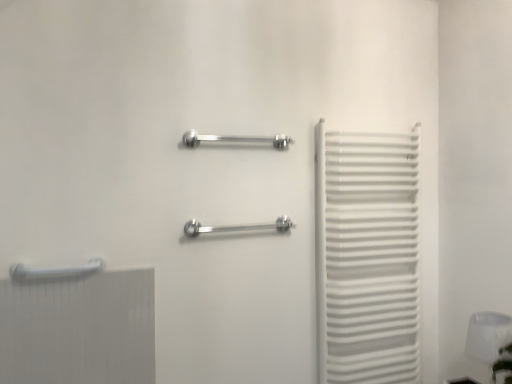
Question: Considering the relative sizes of white glossy towel rack at right and white glossy towel rack at lower left, which appears as the 1th towel rack when ordered from the bottom, in the image provided, is white glossy towel rack at right bigger than white glossy towel rack at lower left, which appears as the 1th towel rack when ordered from the bottom,?

Choices:
 (A) no
 (B) yes

Answer: (B)

Question: Would you say white glossy towel rack at right is a long distance from white glossy towel rack at lower left, marked as the 3th towel rack in a right-to-left arrangement?

Choices:
 (A) yes
 (B) no

Answer: (A)

Question: From a real-world perspective, is white glossy towel rack at right on top of white glossy towel rack at lower left, positioned as the first towel rack in left-to-right order?

Choices:
 (A) yes
 (B) no

Answer: (B)

Question: Does white glossy towel rack at right have a greater width compared to white glossy towel rack at lower left, which appears as the 1th towel rack when ordered from the bottom?

Choices:
 (A) yes
 (B) no

Answer: (A)

Question: Is white glossy towel rack at right closer to camera compared to white glossy towel rack at lower left, which appears as the 1th towel rack when ordered from the bottom?

Choices:
 (A) no
 (B) yes

Answer: (A)

Question: From the image's perspective, is white glossy towel rack at right above or below polished metal towel rack at center, the 1th towel rack positioned from the right?

Choices:
 (A) above
 (B) below

Answer: (B)

Question: Considering the positions of white glossy towel rack at right and polished metal towel rack at center, the 1th towel rack positioned from the right, in the image, is white glossy towel rack at right taller or shorter than polished metal towel rack at center, the 1th towel rack positioned from the right,?

Choices:
 (A) tall
 (B) short

Answer: (A)

Question: In the image, is white glossy towel rack at right positioned in front of or behind polished metal towel rack at center, which is the second towel rack from top to bottom?

Choices:
 (A) front
 (B) behind

Answer: (B)

Question: Choose the correct answer: Is white glossy towel rack at right inside polished metal towel rack at center, the 1th towel rack positioned from the right, or outside it?

Choices:
 (A) inside
 (B) outside

Answer: (B)

Question: Considering their positions, is polished chrome towel rack at center, the 3th towel rack ordered from the bottom, located in front of or behind white glossy lampshade at lower right?

Choices:
 (A) front
 (B) behind

Answer: (B)

Question: Considering the positions of point pyautogui.click(x=205, y=137) and point pyautogui.click(x=498, y=354), is point pyautogui.click(x=205, y=137) closer or farther from the camera than point pyautogui.click(x=498, y=354)?

Choices:
 (A) closer
 (B) farther

Answer: (B)

Question: From the image's perspective, relative to white glossy lampshade at lower right, is polished chrome towel rack at center, the second towel rack when ordered from left to right, above or below?

Choices:
 (A) below
 (B) above

Answer: (B)

Question: From their relative heights in the image, would you say polished chrome towel rack at center, the second towel rack when ordered from left to right, is taller or shorter than white glossy lampshade at lower right?

Choices:
 (A) short
 (B) tall

Answer: (A)

Question: Considering their positions, is white glossy towel rack at lower left, marked as the 3th towel rack in a right-to-left arrangement, located in front of or behind white glossy lampshade at lower right?

Choices:
 (A) behind
 (B) front

Answer: (B)

Question: In terms of height, does white glossy towel rack at lower left, positioned as the first towel rack in left-to-right order, look taller or shorter compared to white glossy lampshade at lower right?

Choices:
 (A) tall
 (B) short

Answer: (B)